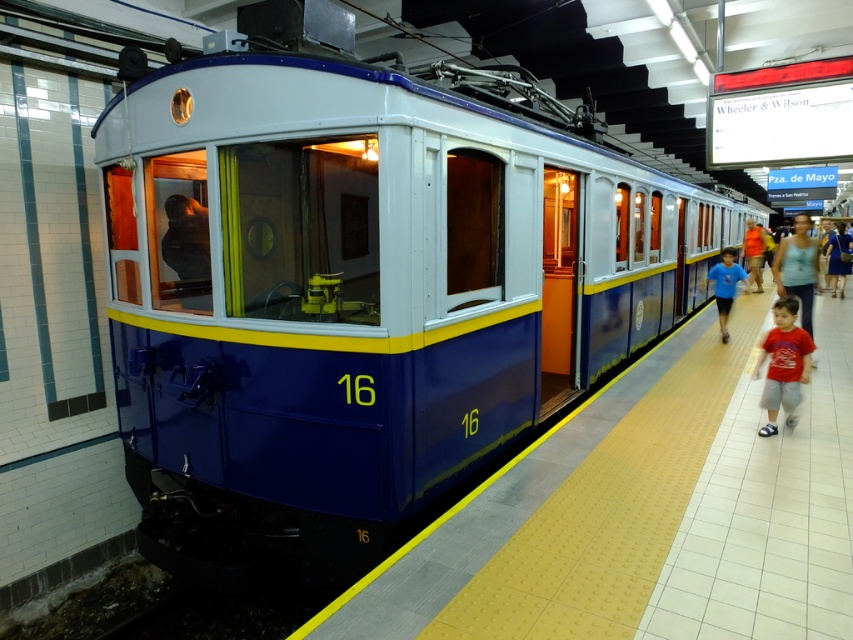
Question: Which point is closer to the camera taking this photo?

Choices:
 (A) (799, 257)
 (B) (844, 256)
 (C) (149, 124)

Answer: (C)

Question: Which of the following is the farthest from the observer?

Choices:
 (A) (831, 268)
 (B) (552, 435)
 (C) (795, 216)
 (D) (138, 150)

Answer: (C)

Question: Is blue polished metal train at center above blue cotton shirt at center?

Choices:
 (A) no
 (B) yes

Answer: (B)

Question: Is blue polished metal train at center further to camera compared to blue cotton shirt at center?

Choices:
 (A) no
 (B) yes

Answer: (A)

Question: Which point is closer to the camera taking this photo?

Choices:
 (A) (851, 260)
 (B) (223, 314)

Answer: (B)

Question: Does blue glossy platform at center come in front of blue cotton shirt at center?

Choices:
 (A) yes
 (B) no

Answer: (A)